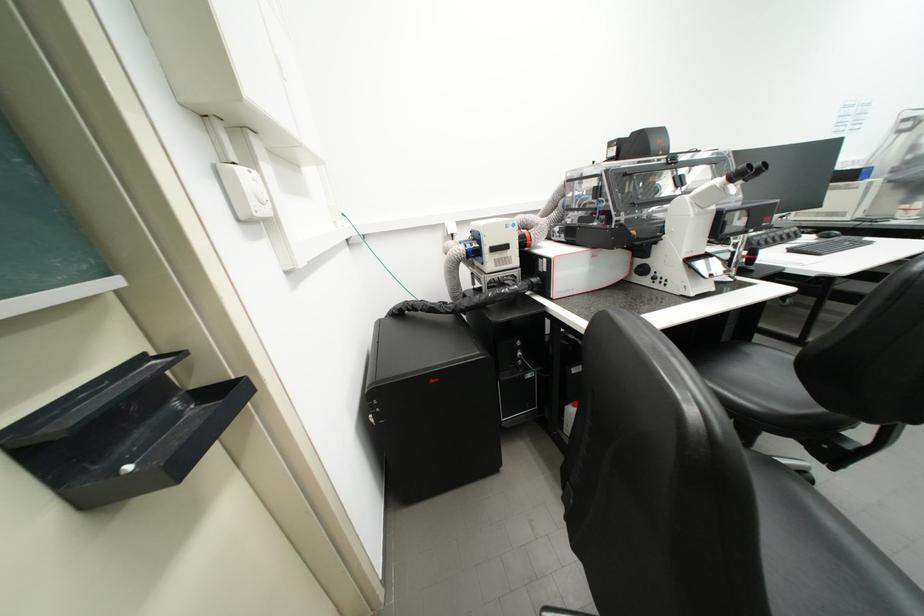
Find where to turn the microscope focusing knob. Please return your answer as a coordinate pair (x, y).

(738, 172)